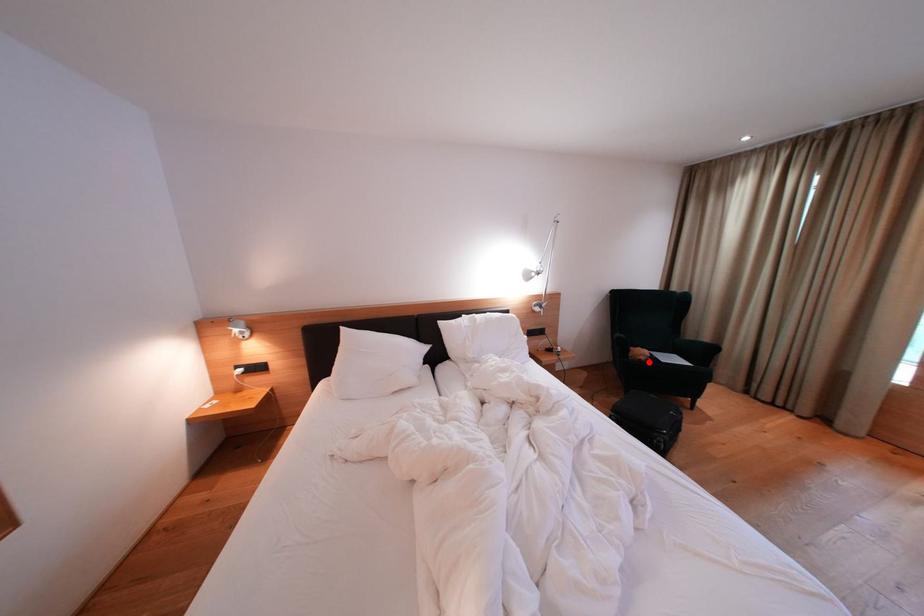
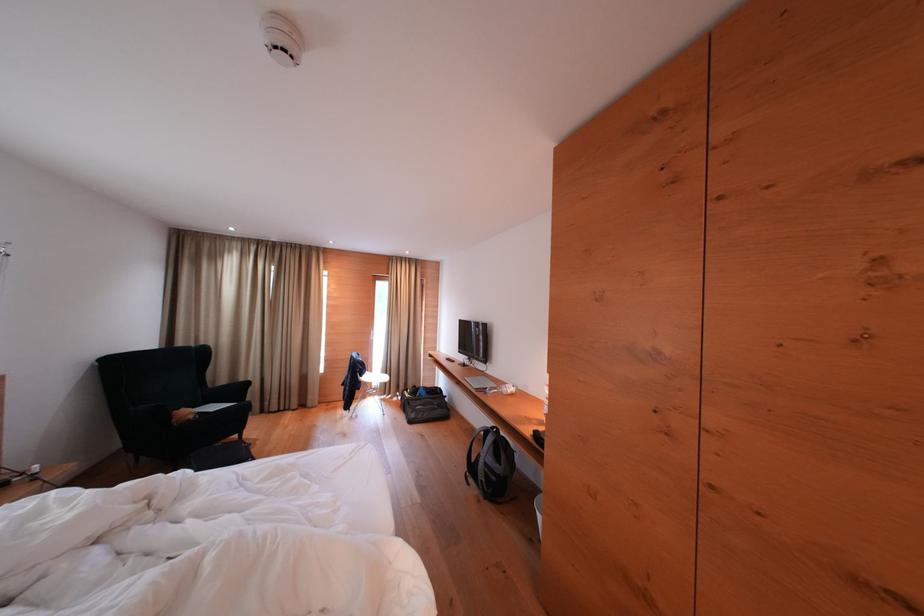
Locate, in the second image, the point that corresponds to the highlighted location in the first image.

(198, 421)